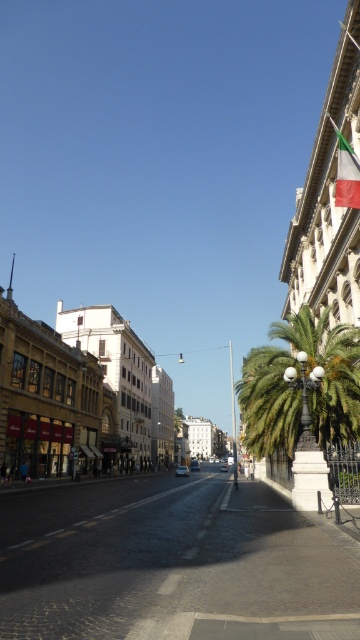
Question: Does green leafy palm tree at right have a lesser width compared to green fabric flag at upper right?

Choices:
 (A) yes
 (B) no

Answer: (B)

Question: Is green leafy palm tree at right behind green fabric flag at upper right?

Choices:
 (A) yes
 (B) no

Answer: (B)

Question: Among these points, which one is nearest to the camera?

Choices:
 (A) (349, 177)
 (B) (312, 429)

Answer: (A)

Question: Is green leafy palm tree at right above green fabric flag at upper right?

Choices:
 (A) no
 (B) yes

Answer: (A)